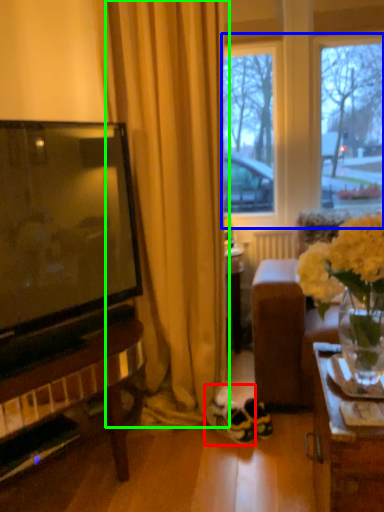
Question: Which object is the closest to the sneakers (highlighted by a red box)? Choose among these: window frame (highlighted by a blue box) or curtain (highlighted by a green box).

Choices:
 (A) window frame
 (B) curtain

Answer: (B)